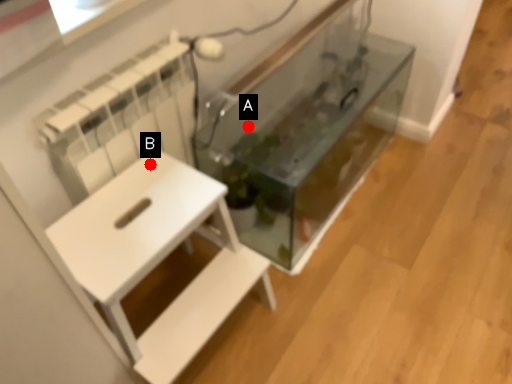
Question: Two points are circled on the image, labeled by A and B beside each circle. Among these points, which one is nearest to the camera?

Choices:
 (A) A is closer
 (B) B is closer

Answer: (B)